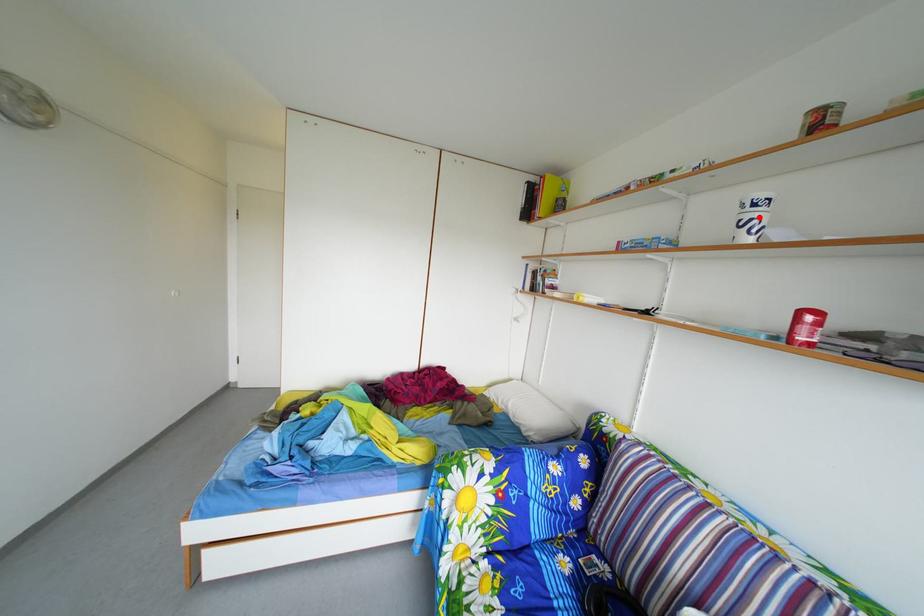
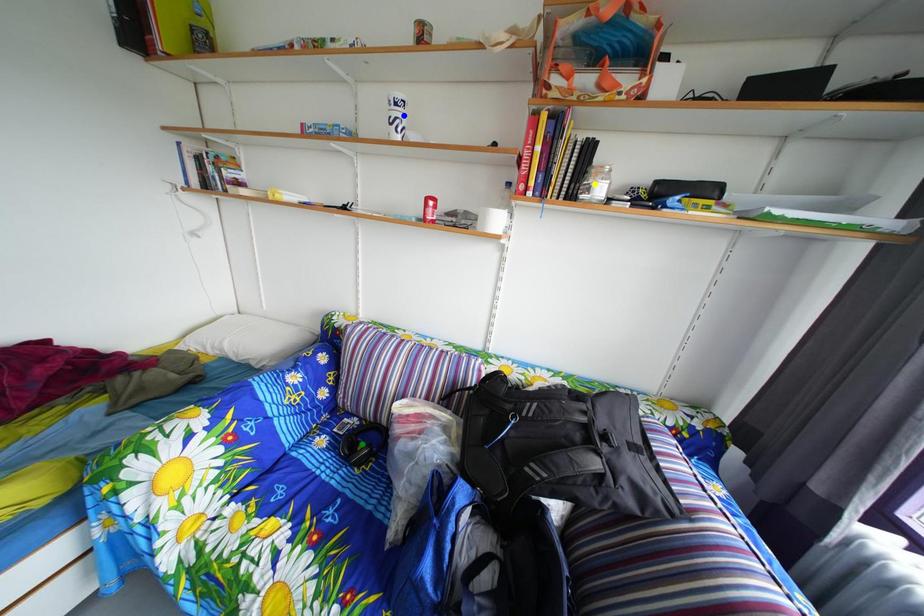
Question: I am providing you with two images of the same scene from different viewpoints. A red point is marked on the first image. You are given multiple points on the second image. Which point in image 2 is actually the same real-world point as the red point in image 1?

Choices:
 (A) blue point
 (B) green point
 (C) yellow point

Answer: (A)